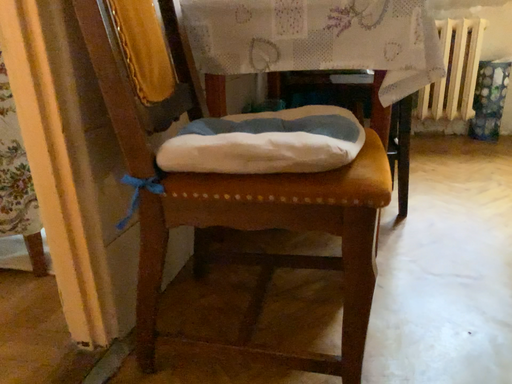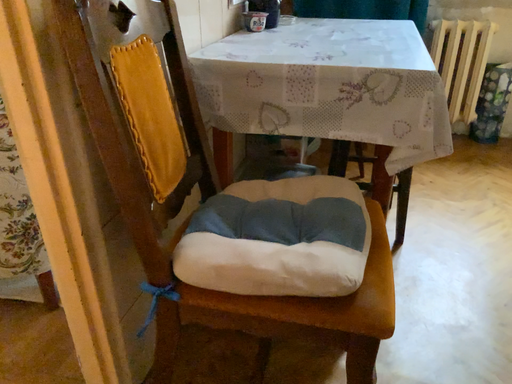
Question: How did the camera likely rotate when shooting the video?

Choices:
 (A) rotated upward
 (B) rotated downward

Answer: (B)